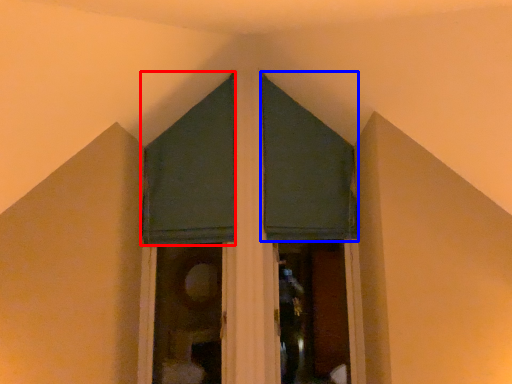
Question: Which point is closer to the camera, curtain (highlighted by a red box) or curtain (highlighted by a blue box)?

Choices:
 (A) curtain
 (B) curtain

Answer: (A)